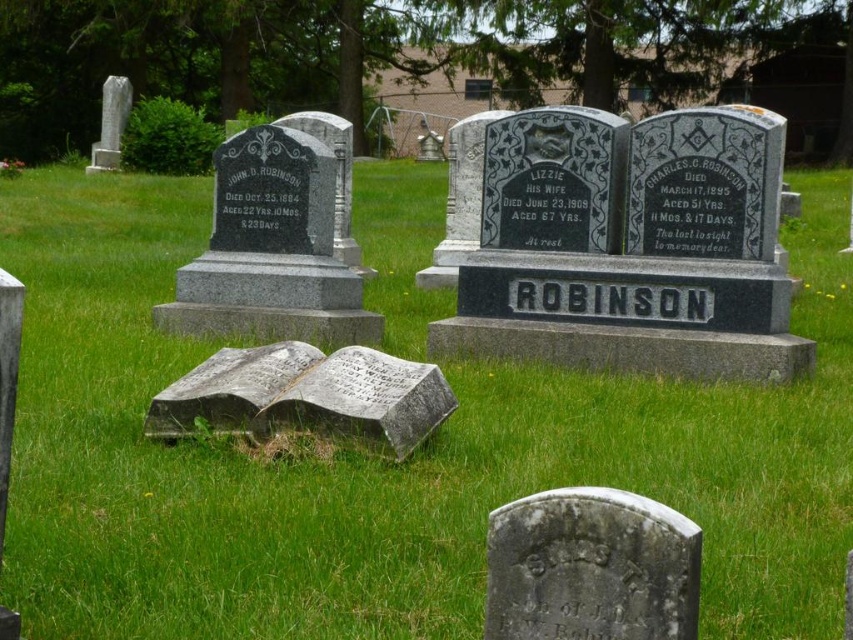
Question: Can you confirm if gray stone gravestone at lower center is wider than gray stone book at center?

Choices:
 (A) no
 (B) yes

Answer: (A)

Question: Does gray stone gravestone at lower center have a larger size compared to gray stone book at center?

Choices:
 (A) yes
 (B) no

Answer: (B)

Question: Which point is farther from the camera taking this photo?

Choices:
 (A) (338, 404)
 (B) (540, 540)

Answer: (A)

Question: Is the position of gray stone gravestone at lower center more distant than that of gray stone book at center?

Choices:
 (A) yes
 (B) no

Answer: (B)